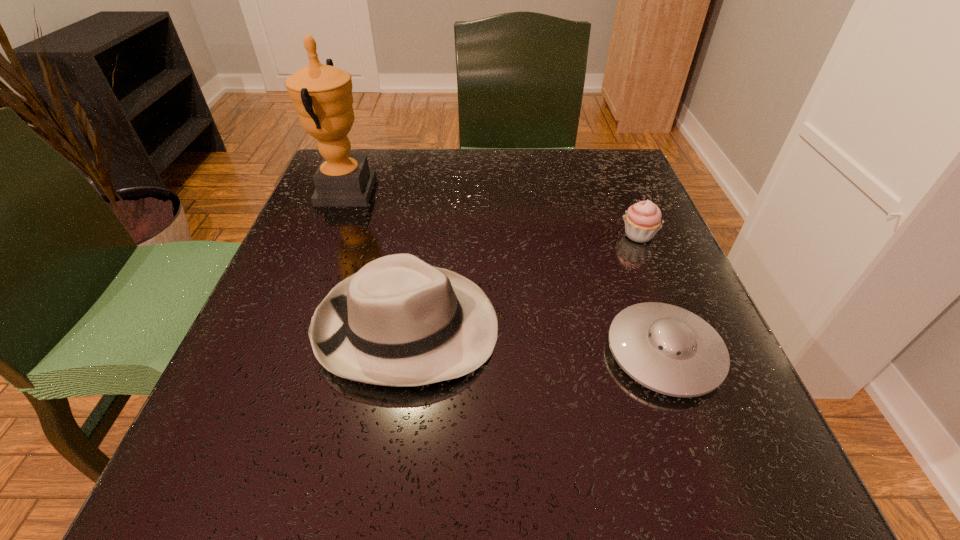
Find the location of `free space between the fedora and the shortest object`. free space between the fedora and the shortest object is located at coordinates (536, 340).

In order to click on object that is the third closest one to the second tallest object in this screenshot , I will do `click(642, 220)`.

Identify which object is the closest to the award. Please provide its 2D coordinates. Your answer should be formatted as a tuple, i.e. [(x, y)], where the tuple contains the x and y coordinates of a point satisfying the conditions above.

[(398, 321)]

Locate an element on the screen. The width and height of the screenshot is (960, 540). free space that satisfies the following two spatial constraints: 1. at the front of the award with handles; 2. on the right side of the cupcake is located at coordinates (328, 235).

Locate an element on the screen. free space that satisfies the following two spatial constraints: 1. on the front-facing side of the third shortest object; 2. on the left side of the shortest object is located at coordinates pos(403,353).

Locate an element on the screen. The width and height of the screenshot is (960, 540). free space in the image that satisfies the following two spatial constraints: 1. at the front of the farthest object with handles; 2. on the back side of the shortest object is located at coordinates (x=281, y=353).

Image resolution: width=960 pixels, height=540 pixels. I want to click on blank space that satisfies the following two spatial constraints: 1. on the front side of the cupcake; 2. on the front-facing side of the second tallest object, so click(x=676, y=327).

Where is `free space that satisfies the following two spatial constraints: 1. on the front-facing side of the third shortest object; 2. on the right side of the saucer`? Image resolution: width=960 pixels, height=540 pixels. free space that satisfies the following two spatial constraints: 1. on the front-facing side of the third shortest object; 2. on the right side of the saucer is located at coordinates (403, 353).

Locate an element on the screen. The height and width of the screenshot is (540, 960). vacant space that satisfies the following two spatial constraints: 1. at the front of the award with handles; 2. on the right side of the cupcake is located at coordinates (328, 235).

Identify the location of vacant position in the image that satisfies the following two spatial constraints: 1. on the front side of the second shortest object; 2. on the front-facing side of the fedora. (676, 327).